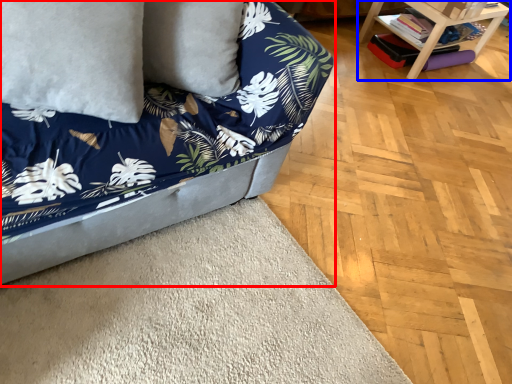
Question: Among these objects, which one is nearest to the camera, studio couch (highlighted by a red box) or table (highlighted by a blue box)?

Choices:
 (A) studio couch
 (B) table

Answer: (A)